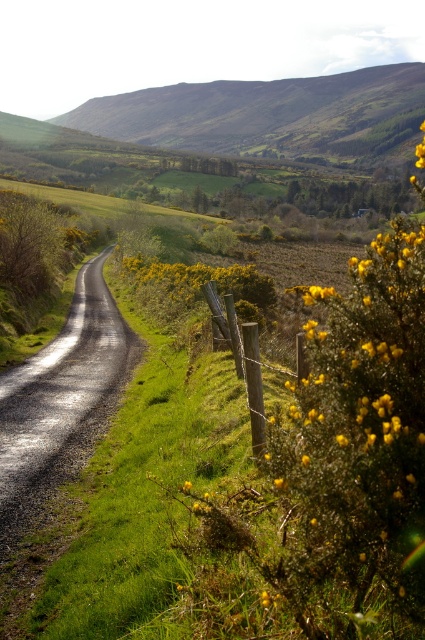
Question: Is green grassy hillside at upper center positioned behind wooden post at center?

Choices:
 (A) no
 (B) yes

Answer: (B)

Question: Which point is farther to the camera?

Choices:
 (A) (209, 308)
 (B) (297, 145)

Answer: (B)

Question: Does green grassy hillside at upper center appear under wooden post at center?

Choices:
 (A) yes
 (B) no

Answer: (B)

Question: Is green grassy hillside at upper center above wooden post at center?

Choices:
 (A) yes
 (B) no

Answer: (A)